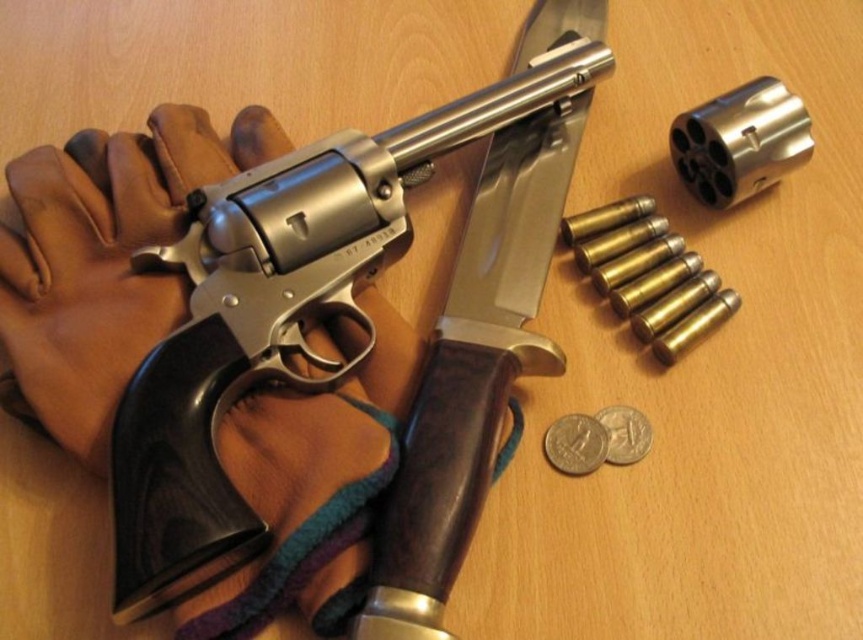
You are a detective examining the scene. You notice the brown leather glove at left and the silver metallic coin at lower right. Which object has a greater width?

The brown leather glove at left has a greater width than the silver metallic coin at lower right.

You are a detective examining the scene. You see a point at coordinates [105,259]. What object is this point located on?

The point at coordinates [105,259] is located on the brown leather glove at left.

You are a gunsmith examining a revolver on a wooden table. The revolver has a cylinder to its right. You need to place six cartridges into the revolver. Where exactly should you place the cartridges relative to the revolver located at point (274,317)?

The cartridges should be placed into the six chambers of the cylinder located to the right of the polished metal revolver at center at point (274,317).